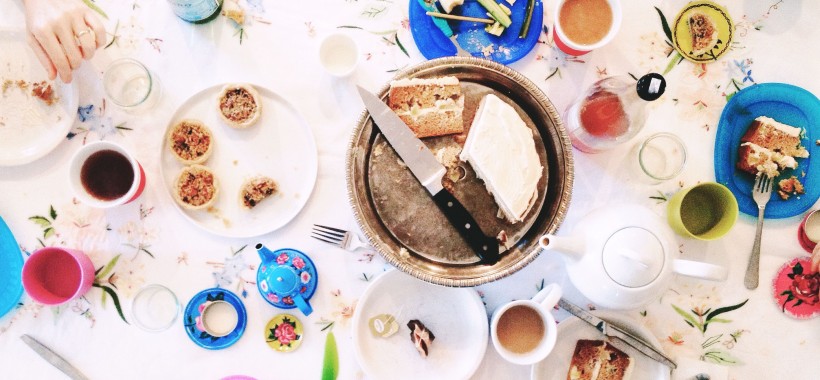
You are a GUI agent. You are given a task and a screenshot of the screen. Output one action in this format:
    pyautogui.click(x=<x>, y=<y>)
    Task: Click on the cup
    The width and height of the screenshot is (820, 380).
    Given the screenshot: What is the action you would take?
    pyautogui.click(x=707, y=234)